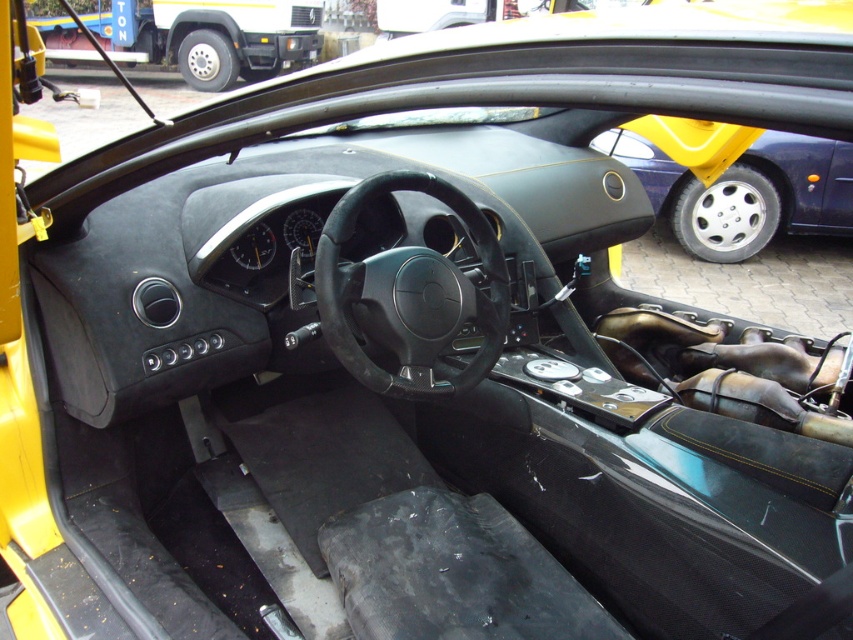
Question: Where is black leather steering wheel at center located in relation to metallic silver wheel at right in the image?

Choices:
 (A) left
 (B) right

Answer: (A)

Question: Does black leather steering wheel at center appear over metallic silver wheel at right?

Choices:
 (A) yes
 (B) no

Answer: (B)

Question: Which object appears closest to the camera in this image?

Choices:
 (A) black leather steering wheel at center
 (B) metallic silver wheel at right

Answer: (A)

Question: Is black leather steering wheel at center positioned in front of metallic silver wheel at right?

Choices:
 (A) no
 (B) yes

Answer: (B)

Question: Which point is closer to the camera?

Choices:
 (A) black leather steering wheel at center
 (B) metallic silver wheel at right

Answer: (A)